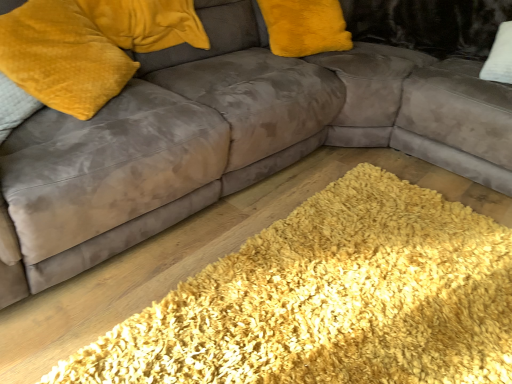
Where is `vacant space underneath shaggy yellow rug at lower center (from a real-world perspective)`? The width and height of the screenshot is (512, 384). vacant space underneath shaggy yellow rug at lower center (from a real-world perspective) is located at coordinates (329, 290).